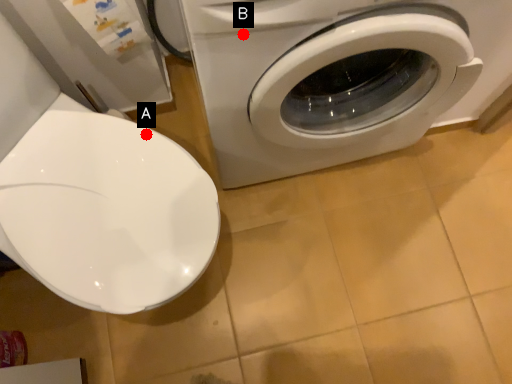
Question: Two points are circled on the image, labeled by A and B beside each circle. Which point is closer to the camera?

Choices:
 (A) A is closer
 (B) B is closer

Answer: (B)